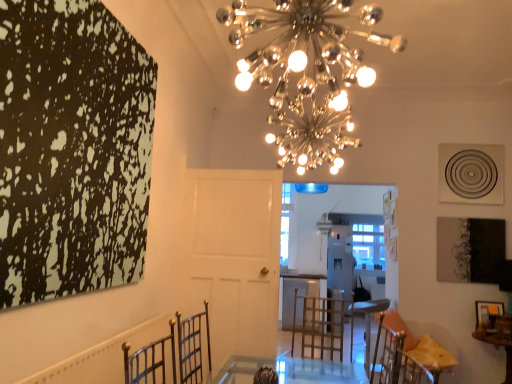
Question: Is metallic gold chair at lower right closer to the viewer compared to wooden picture frame at lower right?

Choices:
 (A) yes
 (B) no

Answer: (A)

Question: Is metallic gold chair at lower right shorter than wooden picture frame at lower right?

Choices:
 (A) no
 (B) yes

Answer: (A)

Question: Is wooden picture frame at lower right a part of metallic gold chair at lower right?

Choices:
 (A) yes
 (B) no

Answer: (B)

Question: Is metallic gold chair at lower right outside wooden picture frame at lower right?

Choices:
 (A) yes
 (B) no

Answer: (A)

Question: Is metallic gold chair at lower right taller than wooden picture frame at lower right?

Choices:
 (A) yes
 (B) no

Answer: (A)

Question: Does point (508, 357) appear closer or farther from the camera than point (501, 306)?

Choices:
 (A) closer
 (B) farther

Answer: (B)

Question: Considering the positions of wooden table at lower right and wooden picture frame at lower right in the image, is wooden table at lower right taller or shorter than wooden picture frame at lower right?

Choices:
 (A) tall
 (B) short

Answer: (A)

Question: Choose the correct answer: Is wooden table at lower right inside wooden picture frame at lower right or outside it?

Choices:
 (A) outside
 (B) inside

Answer: (A)

Question: From the image's perspective, is wooden table at lower right above or below wooden picture frame at lower right?

Choices:
 (A) above
 (B) below

Answer: (B)

Question: In the image, is metallic spherical lights at upper center on the left side or the right side of wooden table at lower right?

Choices:
 (A) right
 (B) left

Answer: (B)

Question: Considering the positions of metallic spherical lights at upper center and wooden table at lower right in the image, is metallic spherical lights at upper center wider or thinner than wooden table at lower right?

Choices:
 (A) wide
 (B) thin

Answer: (A)

Question: Is metallic spherical lights at upper center bigger or smaller than wooden table at lower right?

Choices:
 (A) big
 (B) small

Answer: (A)

Question: From the image's perspective, is metallic spherical lights at upper center positioned above or below wooden table at lower right?

Choices:
 (A) above
 (B) below

Answer: (A)

Question: Looking at the image, does wooden table at lower right seem bigger or smaller compared to metallic spherical lights at upper center?

Choices:
 (A) small
 (B) big

Answer: (A)

Question: Is wooden table at lower right taller or shorter than metallic spherical lights at upper center?

Choices:
 (A) tall
 (B) short

Answer: (B)